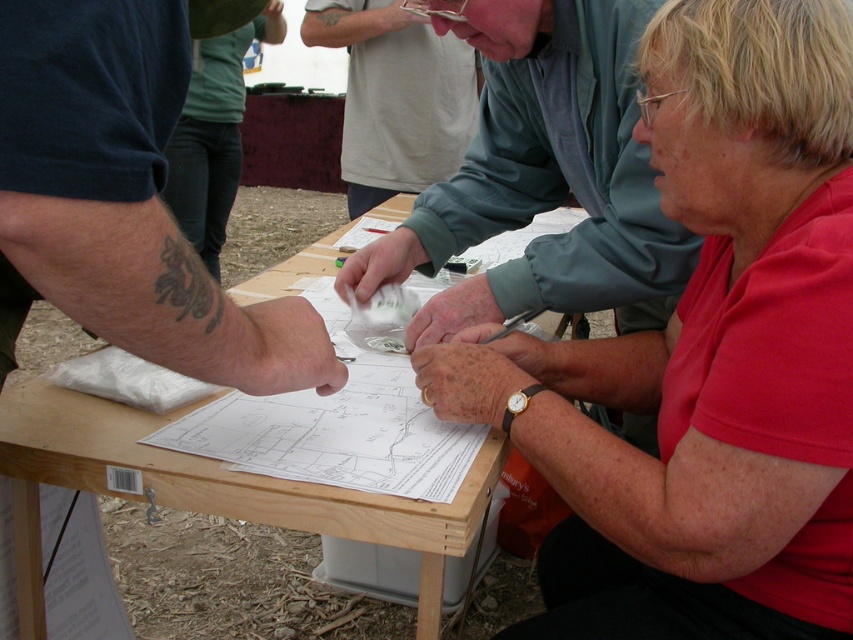
Is point (27, 486) closer to viewer compared to point (196, 145)?

Yes, point (27, 486) is in front of point (196, 145).

Is wooden table at center positioned at the back of jeans at center?

No, wooden table at center is closer to the viewer.

Between point (189, 481) and point (173, 208), which one is positioned in front?

Point (189, 481) is in front.

Locate an element on the screen. Image resolution: width=853 pixels, height=640 pixels. wooden table at center is located at coordinates (x=209, y=490).

Is red matte shirt at center taller than gray matte shirt at upper center?

Indeed, red matte shirt at center has a greater height compared to gray matte shirt at upper center.

Can you confirm if red matte shirt at center is wider than gray matte shirt at upper center?

No.

Find the location of a particular element. The height and width of the screenshot is (640, 853). red matte shirt at center is located at coordinates (706, 355).

You are a GUI agent. You are given a task and a screenshot of the screen. Output one action in this format:
    pyautogui.click(x=<x>, y=<y>)
    Task: Click on the red matte shirt at center
    
    Given the screenshot: What is the action you would take?
    pyautogui.click(x=706, y=355)

Which is more to the left, red matte shirt at center or jeans at center?

jeans at center is more to the left.

Does red matte shirt at center have a larger size compared to jeans at center?

Incorrect, red matte shirt at center is not larger than jeans at center.

Does point (701, 332) come in front of point (229, 208)?

Yes, point (701, 332) is in front of point (229, 208).

Identify the location of red matte shirt at center. (706, 355).